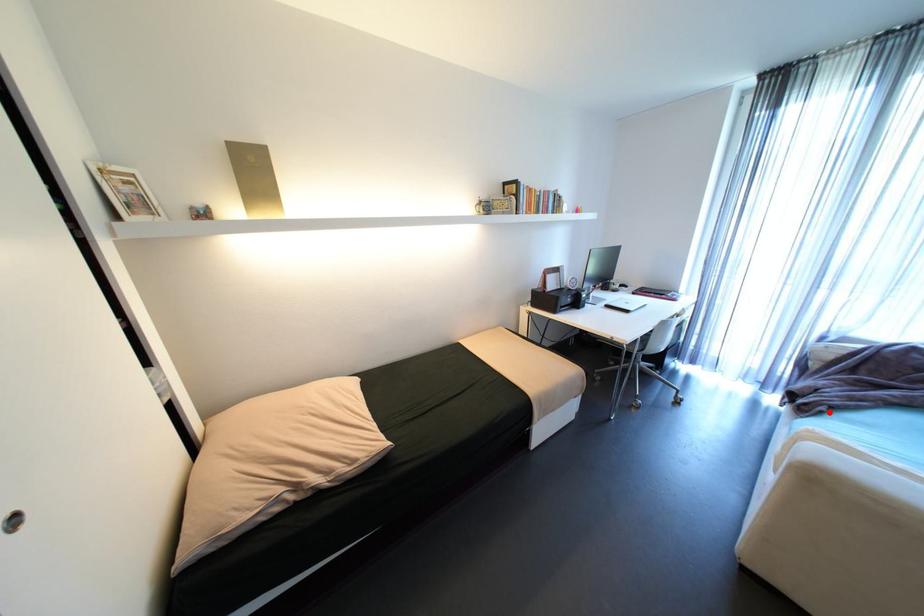
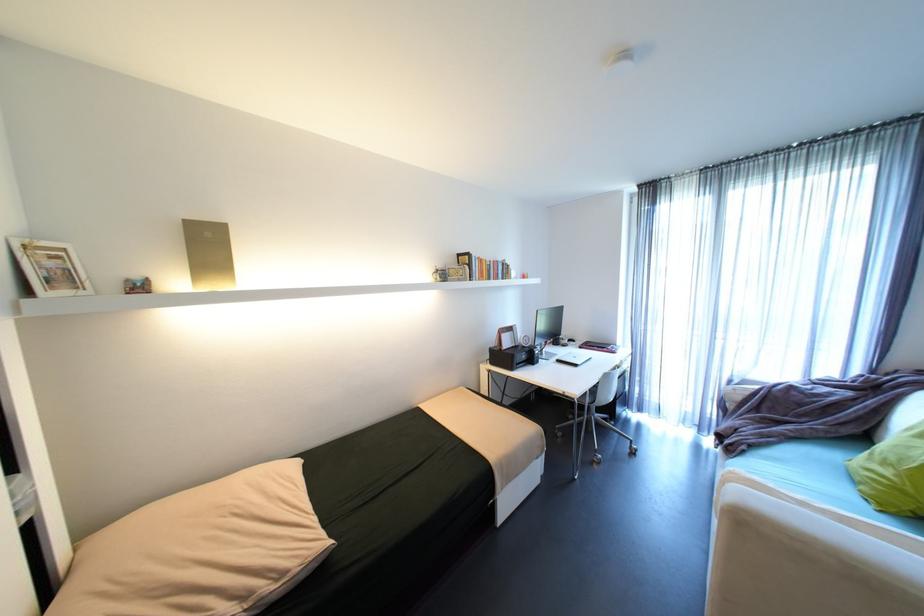
Where in the second image is the point corresponding to the highlighted location from the first image?

(751, 451)